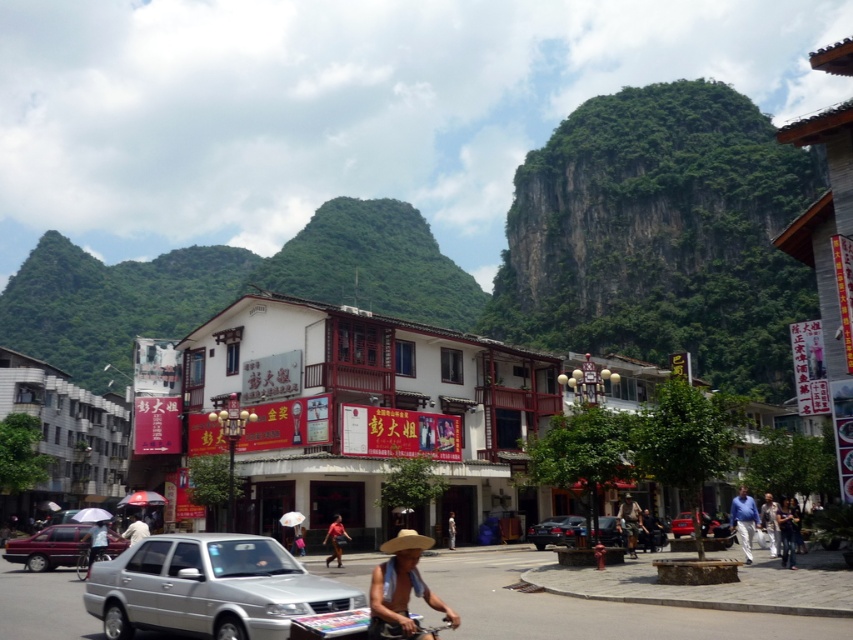
You are a photographer trying to capture a photo of the metallic red car at center and the red shirt at center. Since both are at the center, you need to adjust your camera angle to focus on one. Which object should you zoom in on to ensure it fills the frame without cropping, considering their sizes?

The metallic red car at center is wider than the red shirt at center. Therefore, zooming in on the metallic red car at center would require a closer shot to fill the frame without cropping, whereas the red shirt at center could be captured with a wider angle since it is smaller.

Based on the scene description, where is the green leafy mountain at upper left located in terms of its 2D coordinates?

The green leafy mountain at upper left is located at the 2D coordinates of point (228, 285).

You are a traveler standing on the street and need to decide which item to pick up first. The light brown straw hat at lower center and the brown leather jacket at lower right are both on the ground. Which item is taller?

The light brown straw hat at lower center is taller than the brown leather jacket at lower right.